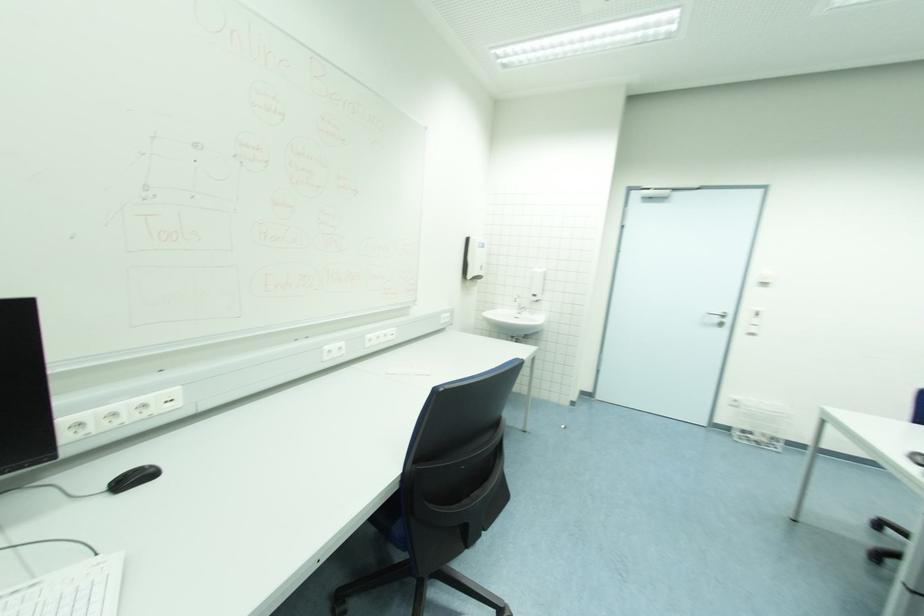
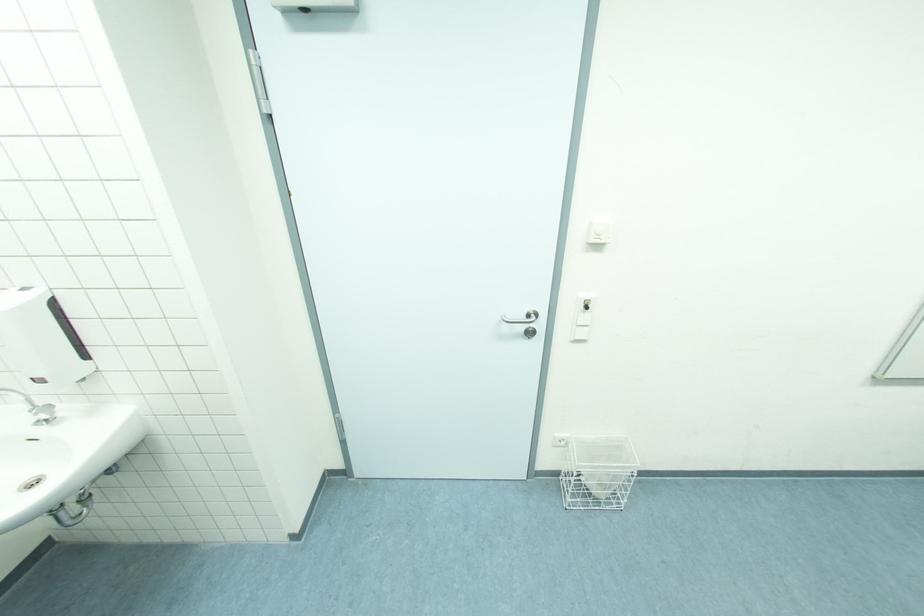
Where in the second image is the point corresponding to the point at 758,322 from the first image?

(589, 318)